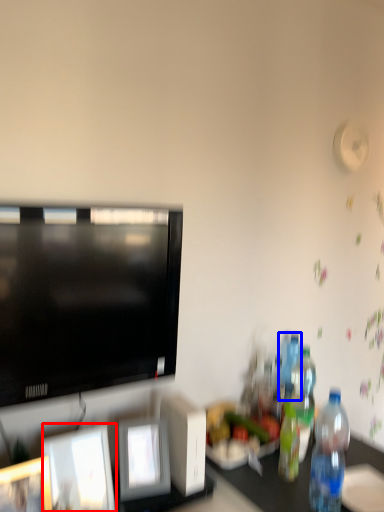
Question: Which object is further to the camera taking this photo, picture frame (highlighted by a red box) or bottle (highlighted by a blue box)?

Choices:
 (A) picture frame
 (B) bottle

Answer: (B)